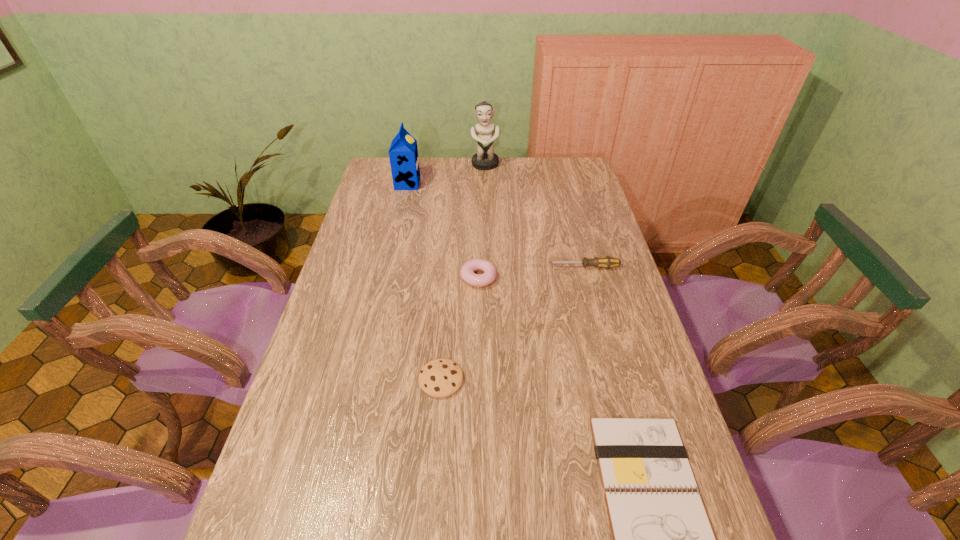
You are a GUI agent. You are given a task and a screenshot of the screen. Output one action in this format:
    pyautogui.click(x=<x>, y=<y>)
    Task: Click on the figurine
    This screenshot has height=540, width=960.
    Given the screenshot: What is the action you would take?
    pyautogui.click(x=485, y=159)

Find the location of a particular element. This screenshot has width=960, height=540. carton is located at coordinates (403, 153).

You are a GUI agent. You are given a task and a screenshot of the screen. Output one action in this format:
    pyautogui.click(x=<x>, y=<y>)
    Task: Click on the second farthest object
    
    Given the screenshot: What is the action you would take?
    pyautogui.click(x=403, y=153)

The height and width of the screenshot is (540, 960). In order to click on doughnut in this screenshot , I will do `click(467, 271)`.

Identify the location of screwdriver. coord(607,262).

Where is `cookie`? This screenshot has width=960, height=540. cookie is located at coordinates (439, 378).

At what (x,y) coordinates should I click in order to perform the action: click on vacant space located 0.270m on the front-facing side of the farthest object. Please return your answer as a coordinate pair (x, y). Looking at the image, I should click on (486, 208).

Locate an element on the screen. This screenshot has width=960, height=540. free space located with the cap open on the leftmost object is located at coordinates (461, 184).

Identify the location of free space located 0.390m on the front of the doughnut. The image size is (960, 540). (478, 401).

You are a GUI agent. You are given a task and a screenshot of the screen. Output one action in this format:
    pyautogui.click(x=<x>, y=<y>)
    Task: Click on the vacant space located at the tip of the screwdriver
    This screenshot has width=960, height=540.
    Given the screenshot: What is the action you would take?
    pyautogui.click(x=466, y=267)